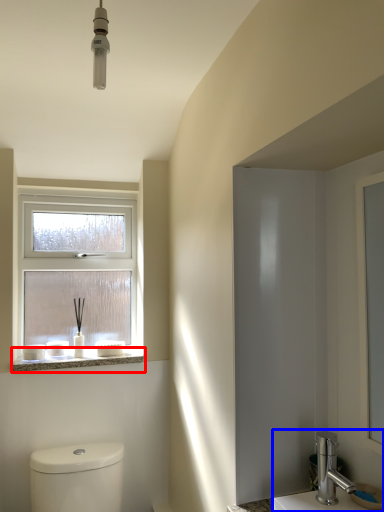
Question: Among these objects, which one is farthest to the camera, window sill (highlighted by a red box) or sink (highlighted by a blue box)?

Choices:
 (A) window sill
 (B) sink

Answer: (A)